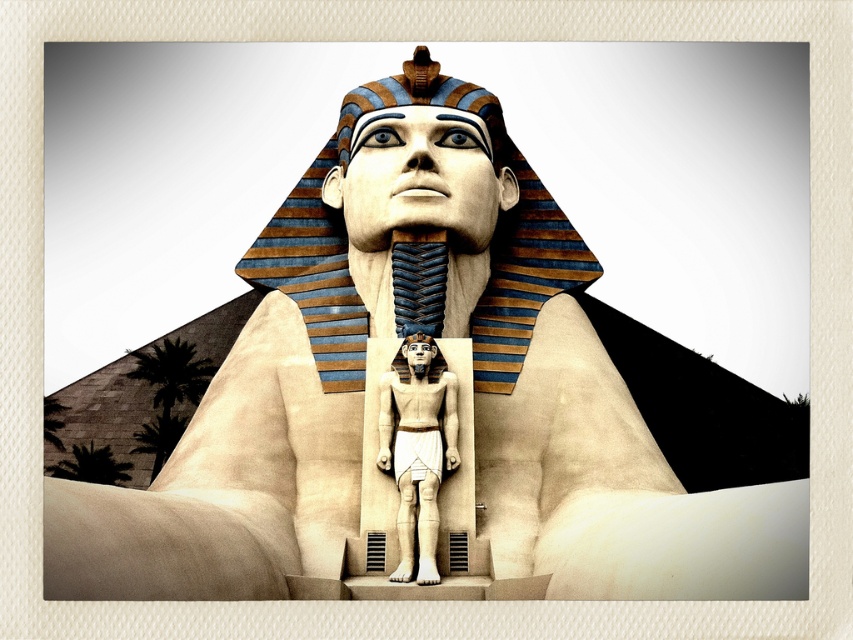
You are an archaeologist examining the scene. You notice two objects at the center of the image. One is the matte gold pharaoh head at center and the other is the white stone statue at center. Which of these two objects is taller?

The matte gold pharaoh head at center is taller than the white stone statue at center.